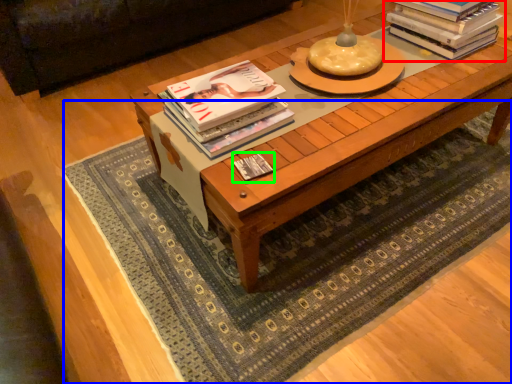
Question: Which object is positioned closest to book (highlighted by a red box)? Select from mat (highlighted by a blue box) and book (highlighted by a green box).

Choices:
 (A) mat
 (B) book

Answer: (A)